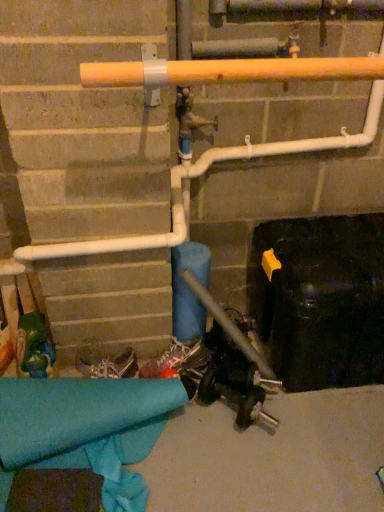
Question: Does white textured sneakers at center come in front of matte orange pipe at upper center?

Choices:
 (A) yes
 (B) no

Answer: (B)

Question: Does white textured sneakers at center appear on the right side of matte orange pipe at upper center?

Choices:
 (A) no
 (B) yes

Answer: (A)

Question: Is white textured sneakers at center facing towards matte orange pipe at upper center?

Choices:
 (A) yes
 (B) no

Answer: (B)

Question: Is white textured sneakers at center smaller than matte orange pipe at upper center?

Choices:
 (A) no
 (B) yes

Answer: (B)

Question: From a real-world perspective, is white textured sneakers at center on top of matte orange pipe at upper center?

Choices:
 (A) no
 (B) yes

Answer: (A)

Question: From the image's perspective, is white textured sneakers at center beneath matte orange pipe at upper center?

Choices:
 (A) yes
 (B) no

Answer: (A)

Question: Is matte orange pipe at upper center surrounding white textured sneakers at center?

Choices:
 (A) no
 (B) yes

Answer: (A)

Question: From the image's perspective, is matte orange pipe at upper center on top of white textured sneakers at center?

Choices:
 (A) no
 (B) yes

Answer: (B)

Question: Is matte orange pipe at upper center beside white textured sneakers at center?

Choices:
 (A) yes
 (B) no

Answer: (B)

Question: Is matte orange pipe at upper center to the left of white textured sneakers at center from the viewer's perspective?

Choices:
 (A) no
 (B) yes

Answer: (A)

Question: Is matte orange pipe at upper center smaller than white textured sneakers at center?

Choices:
 (A) yes
 (B) no

Answer: (B)

Question: Considering the relative sizes of matte orange pipe at upper center and white textured sneakers at center in the image provided, is matte orange pipe at upper center taller than white textured sneakers at center?

Choices:
 (A) yes
 (B) no

Answer: (B)

Question: From the image's perspective, is white textured sneakers at center above or below matte orange pipe at upper center?

Choices:
 (A) above
 (B) below

Answer: (B)